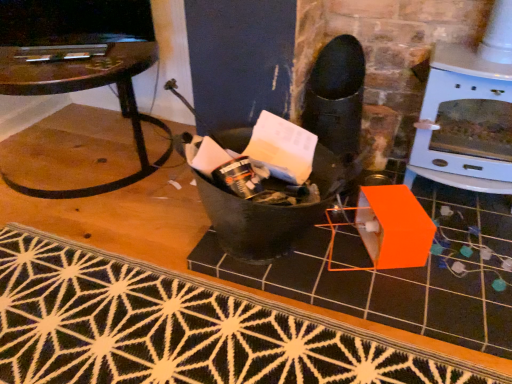
The height and width of the screenshot is (384, 512). In order to click on vacant area that lies between black textured rug at lower center and black matte tile at center in this screenshot , I will do `click(138, 210)`.